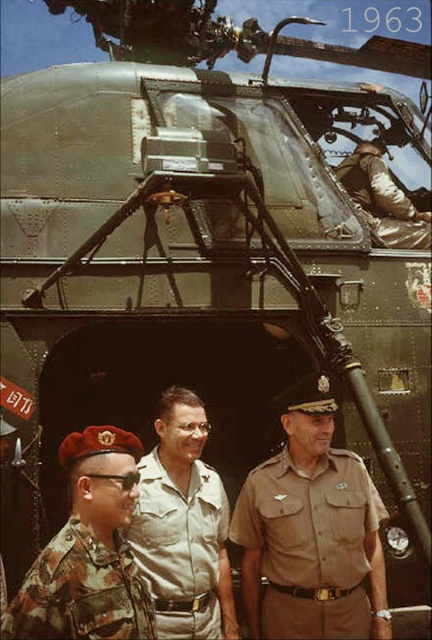
Is brown matte uniform at center to the right of tan fabric uniform at center from the viewer's perspective?

Incorrect, brown matte uniform at center is not on the right side of tan fabric uniform at center.

Looking at this image, does brown matte uniform at center have a greater height compared to tan fabric uniform at center?

Correct, brown matte uniform at center is much taller as tan fabric uniform at center.

The width and height of the screenshot is (432, 640). What do you see at coordinates (311, 541) in the screenshot? I see `brown matte uniform at center` at bounding box center [311, 541].

The height and width of the screenshot is (640, 432). What are the coordinates of `brown matte uniform at center` in the screenshot? It's located at (311, 541).

Is point (136, 572) closer to camera compared to point (384, 172)?

That is True.

Does camouflage fabric uniform at lower left have a lesser height compared to tan fabric uniform at center?

Yes.

Is point (140, 604) positioned before point (412, 230)?

Yes, point (140, 604) is closer to viewer.

You are a GUI agent. You are given a task and a screenshot of the screen. Output one action in this format:
    pyautogui.click(x=<x>, y=<y>)
    Task: Click on the camouflage fabric uniform at lower left
    This screenshot has width=432, height=640.
    Given the screenshot: What is the action you would take?
    pyautogui.click(x=81, y=592)

Is point (171, 516) closer to viewer compared to point (367, 209)?

Yes, it is in front of point (367, 209).

Is point (174, 552) farther from viewer compared to point (371, 208)?

No.

Locate an element on the screen. camouflage fabric shirt at center is located at coordinates (181, 547).